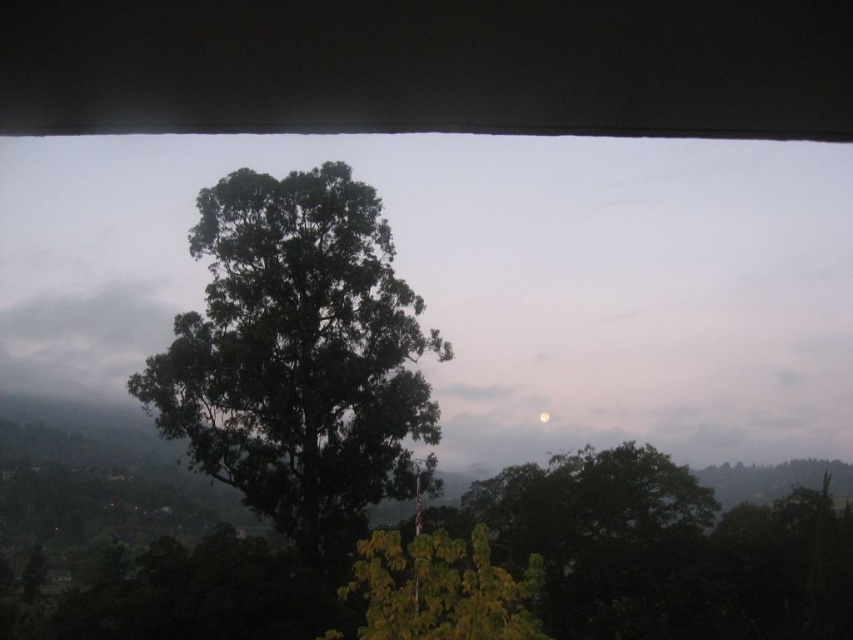
You are standing at the point marked as point (299, 356) in the image. Looking around, you see a green leafy tree at center. Which direction should you walk to reach the green leafy tree at center?

Since point (299, 356) is on the green leafy tree at center, you are already at the green leafy tree at center.

You are an astronomer observing the night sky. You notice the green leafy tree at lower center and the gray fluffy cloud at upper left. Which object appears smaller in the image?

The green leafy tree at lower center appears smaller than the gray fluffy cloud at upper left in the image.

You are an astronomer observing the night sky and notice the green leafy tree at lower center and the gray fluffy cloud at upper left. Which object is closer to the ground?

The green leafy tree at lower center is closer to the ground because it is shorter than the gray fluffy cloud at upper left.